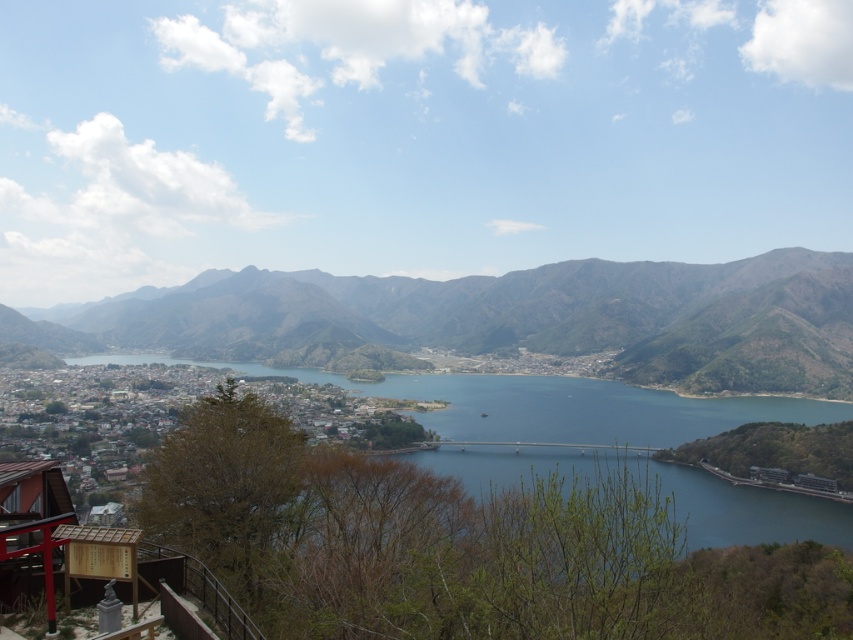
Looking at this image, you are a hiker planning to cross from the brown textured mountains at center to the blue glassy water at center. Can you safely walk directly between them without needing special equipment, given the distance is 123.30 meters?

The distance between the brown textured mountains at center and the blue glassy water at center is 123.30 meters. Since this is a straight path over land, you can safely walk directly between them without needing special equipment.

You are an architect designing a new observation deck overlooking the brown textured mountains at center and the blue glassy water at center. Which of these two features should the deck prioritize for a better view, considering their sizes?

The brown textured mountains at center is larger in size than the blue glassy water at center, so the deck should prioritize the view of the brown textured mountains at center for a more prominent and expansive view.